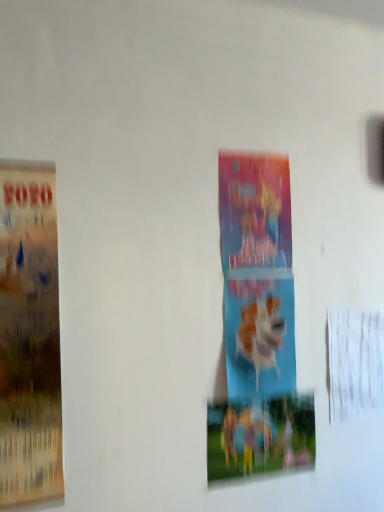
Question: Can you see blue matte dog at center touching matte paper poster at left, which appears as the 1th poster when viewed from the front?

Choices:
 (A) no
 (B) yes

Answer: (A)

Question: Is blue matte dog at center not inside matte paper poster at left, which is counted as the first poster, starting from the left?

Choices:
 (A) no
 (B) yes

Answer: (B)

Question: Does blue matte dog at center come in front of matte paper poster at left, which is counted as the first poster, starting from the left?

Choices:
 (A) no
 (B) yes

Answer: (A)

Question: Is blue matte dog at center at the left side of matte paper poster at left, which appears as the 1th poster when viewed from the front?

Choices:
 (A) yes
 (B) no

Answer: (B)

Question: Is blue matte dog at center thinner than matte paper poster at left, which appears as the 1th poster when viewed from the front?

Choices:
 (A) no
 (B) yes

Answer: (B)

Question: Does blue matte dog at center appear on the right side of matte paper poster at left, which appears as the 1th poster when viewed from the front?

Choices:
 (A) yes
 (B) no

Answer: (A)

Question: Can you confirm if blue matte dog at center is shorter than colorful paper poster at center, the first poster from the right?

Choices:
 (A) no
 (B) yes

Answer: (A)

Question: Is blue matte dog at center facing towards colorful paper poster at center, marked as the 2th poster in a left-to-right arrangement?

Choices:
 (A) yes
 (B) no

Answer: (B)

Question: Is blue matte dog at center smaller than colorful paper poster at center, marked as the 2th poster in a left-to-right arrangement?

Choices:
 (A) yes
 (B) no

Answer: (B)

Question: Is blue matte dog at center located outside colorful paper poster at center, the first poster from the right?

Choices:
 (A) yes
 (B) no

Answer: (A)

Question: From the image's perspective, is blue matte dog at center beneath colorful paper poster at center, marked as the 2th poster in a left-to-right arrangement?

Choices:
 (A) no
 (B) yes

Answer: (A)

Question: Does blue matte dog at center have a greater height compared to colorful paper poster at center, the first poster from the right?

Choices:
 (A) no
 (B) yes

Answer: (B)

Question: Would you say matte paper poster at left, which appears as the 1th poster when viewed from the front, is part of colorful paper poster at center, marked as the 2th poster in a left-to-right arrangement,'s contents?

Choices:
 (A) no
 (B) yes

Answer: (A)